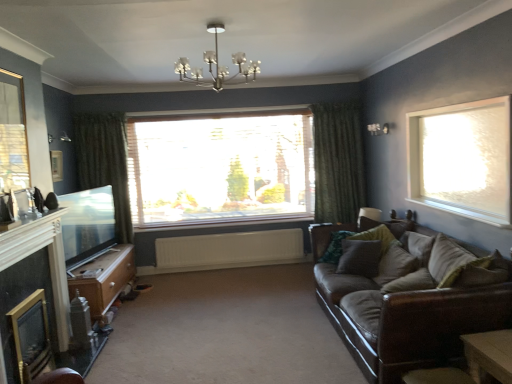
Question: Considering their positions, is green textured curtain at left, which is the first curtain in left-to-right order, located in front of or behind brown leather couch at right?

Choices:
 (A) front
 (B) behind

Answer: (B)

Question: Considering the positions of green textured curtain at left, placed as the 2th curtain when sorted from right to left, and brown leather couch at right in the image, is green textured curtain at left, placed as the 2th curtain when sorted from right to left, taller or shorter than brown leather couch at right?

Choices:
 (A) tall
 (B) short

Answer: (A)

Question: Considering the real-world distances, which object is farthest from the green textured curtain at center, the 1th curtain when ordered from right to left?

Choices:
 (A) wooden picture frame at upper left
 (B) brown leather couch at right
 (C) frosted glass window at upper right, which is the 1th window in right-to-left order
 (D) green textured curtain at left, placed as the 2th curtain when sorted from right to left
 (E) beige fabric pillow at right, which is the 3th pillow in back-to-front order

Answer: (A)

Question: Which of these objects is positioned farthest from the wooden table at lower right?

Choices:
 (A) green textured curtain at center, the second curtain from the left
 (B) beige fabric pillow at right, marked as the second pillow in a front-to-back arrangement
 (C) velvet green pillow at right, which is counted as the fourth pillow, starting from the back
 (D) green textured curtain at left, placed as the 2th curtain when sorted from right to left
 (E) gold-framed glass fireplace at lower left

Answer: (D)